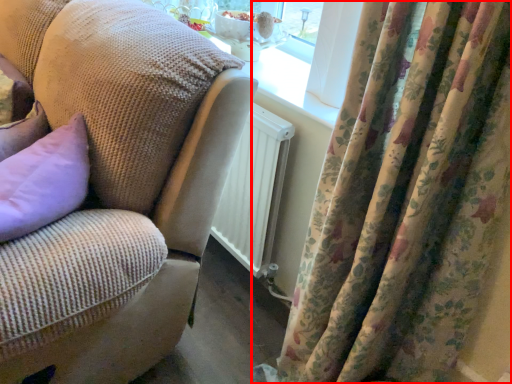
Question: Considering the relative positions of curtain (annotated by the red box) and studio couch in the image provided, where is curtain (annotated by the red box) located with respect to the staircase?

Choices:
 (A) left
 (B) right

Answer: (B)